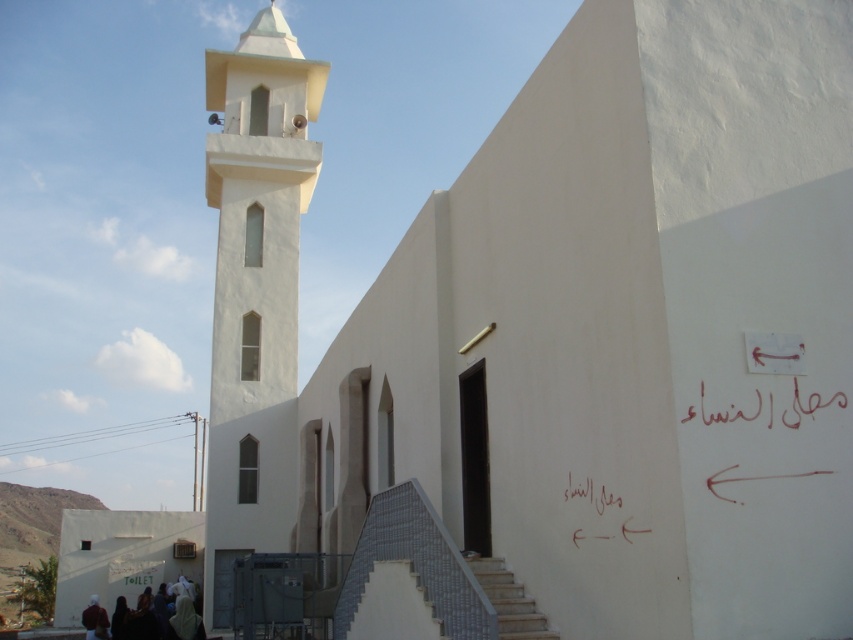
Question: Which point is closer to the camera taking this photo?

Choices:
 (A) (596, 508)
 (B) (424, 560)

Answer: (A)

Question: Can you confirm if gray textured stairs at lower center is wider than handwritten text at center?

Choices:
 (A) no
 (B) yes

Answer: (A)

Question: Which point appears farthest from the camera in this image?

Choices:
 (A) (283, 545)
 (B) (706, 419)
 (C) (474, 566)
 (D) (469, 564)

Answer: (A)

Question: Can you confirm if white fabric people at lower left is positioned above handwritten text at center?

Choices:
 (A) no
 (B) yes

Answer: (A)

Question: From the image, what is the correct spatial relationship of white smooth minaret at center in relation to handwritten red calligraphy at upper right?

Choices:
 (A) left
 (B) right

Answer: (A)

Question: Which point is farther to the camera?

Choices:
 (A) handwritten text at center
 (B) white fabric people at lower left

Answer: (B)